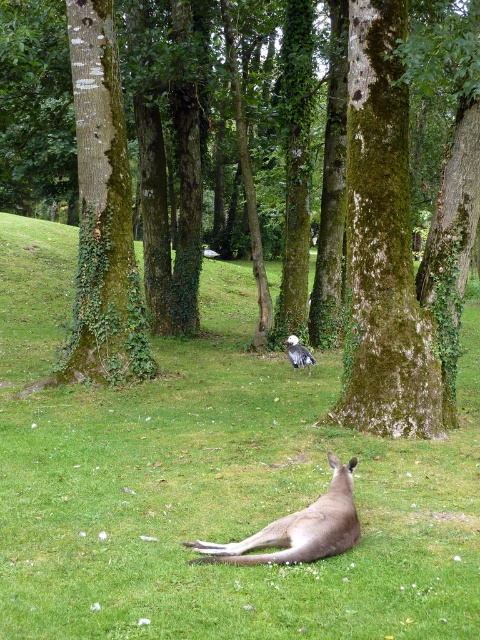
You are a photographer setting up a tripod in the park. You want to capture both the green grassy at center and the green mossy tree at center in your shot. Which object should you focus on first to ensure both are in frame?

The green grassy at center is in front of the green mossy tree at center, so you should focus on the green mossy tree at center first to ensure both are in frame.

You are a wildlife photographer aiming to capture both the gray fur kangaroo at lower center and the white feathered bird at center in a single frame. Given their sizes, which animal should you focus on first to ensure both fit in the photo?

The gray fur kangaroo at lower center is larger than the white feathered bird at center, so you should focus on the gray fur kangaroo at lower center first to ensure both fit in the photo.